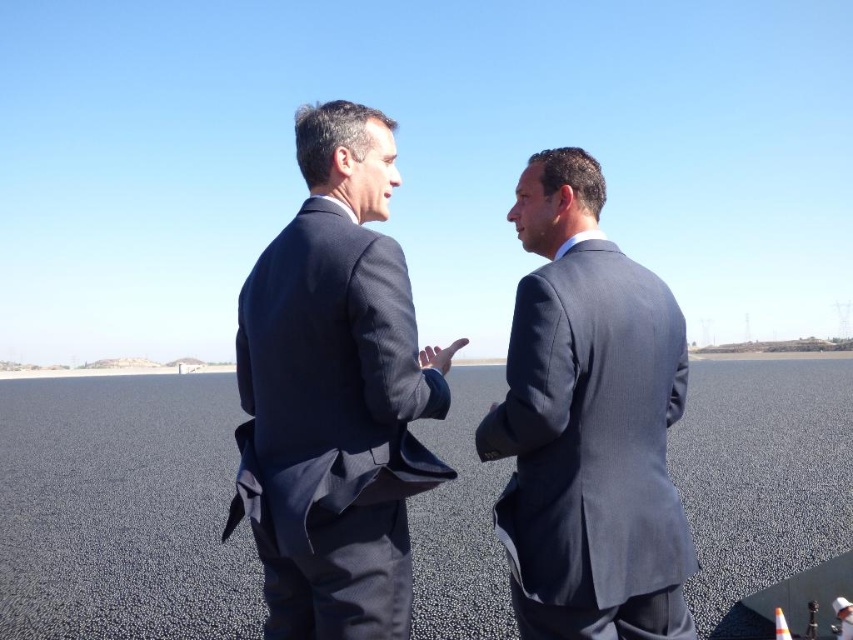
You are a photographer planning to take a wide shot of the scene. Given that the black asphalt tarmac at center and the matte gray suit at center are both in the frame, which object will occupy more of the photo?

The black asphalt tarmac at center occupies more space in the photo because it has a larger size compared to the matte gray suit at center.